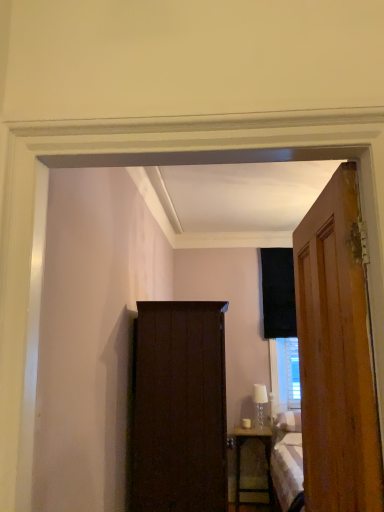
Question: Looking at their shapes, would you say wooden door at right is wider or thinner than wooden nightstand at lower right?

Choices:
 (A) thin
 (B) wide

Answer: (A)

Question: Is wooden door at right to the left or to the right of wooden nightstand at lower right in the image?

Choices:
 (A) right
 (B) left

Answer: (B)

Question: Estimate the real-world distances between objects in this image. Which object is farther from the wooden nightstand at lower right?

Choices:
 (A) white glass lamp at center
 (B) wooden door at right
 (C) dark wood cabinet at center

Answer: (B)

Question: Which object is the farthest from the dark wood cabinet at center?

Choices:
 (A) wooden door at right
 (B) white glass lamp at center
 (C) wooden nightstand at lower right

Answer: (B)